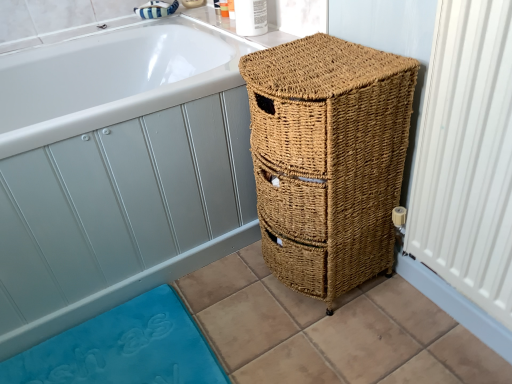
Question: Visually, is white glossy bathtub at upper left positioned to the left or to the right of blue rubber bath mat at lower left?

Choices:
 (A) right
 (B) left

Answer: (B)

Question: Considering the positions of point tap(143, 167) and point tap(78, 331), is point tap(143, 167) closer or farther from the camera than point tap(78, 331)?

Choices:
 (A) closer
 (B) farther

Answer: (A)

Question: Estimate the real-world distances between objects in this image. Which object is closer to the blue rubber bath mat at lower left?

Choices:
 (A) white glossy bathtub at upper left
 (B) white textured radiator at right
 (C) woven brown basket at right

Answer: (A)

Question: Estimate the real-world distances between objects in this image. Which object is farther from the woven brown basket at right?

Choices:
 (A) blue rubber bath mat at lower left
 (B) white glossy bathtub at upper left
 (C) white textured radiator at right

Answer: (A)